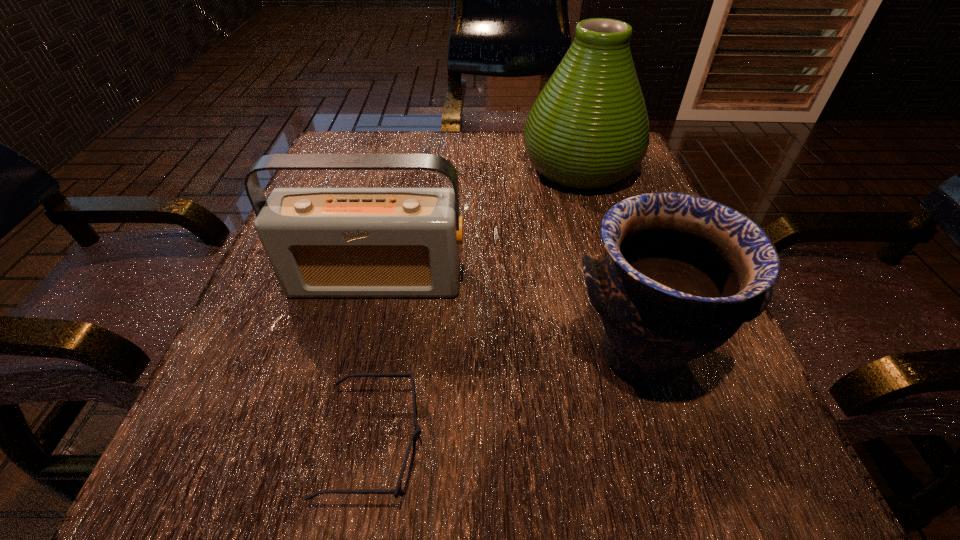
Find the location of `the closest object to the pottery`. the closest object to the pottery is located at coordinates tap(321, 242).

This screenshot has width=960, height=540. I want to click on vacant space that satisfies the following two spatial constraints: 1. on the front handle of the pottery; 2. on the front-facing side of the spectacles, so click(669, 444).

Find the location of a particular element. vacant point that satisfies the following two spatial constraints: 1. on the front handle of the pottery; 2. on the front-facing side of the spectacles is located at coordinates pos(669,444).

The image size is (960, 540). Identify the location of free location that satisfies the following two spatial constraints: 1. on the front handle of the pottery; 2. on the front-facing side of the spectacles. (669, 444).